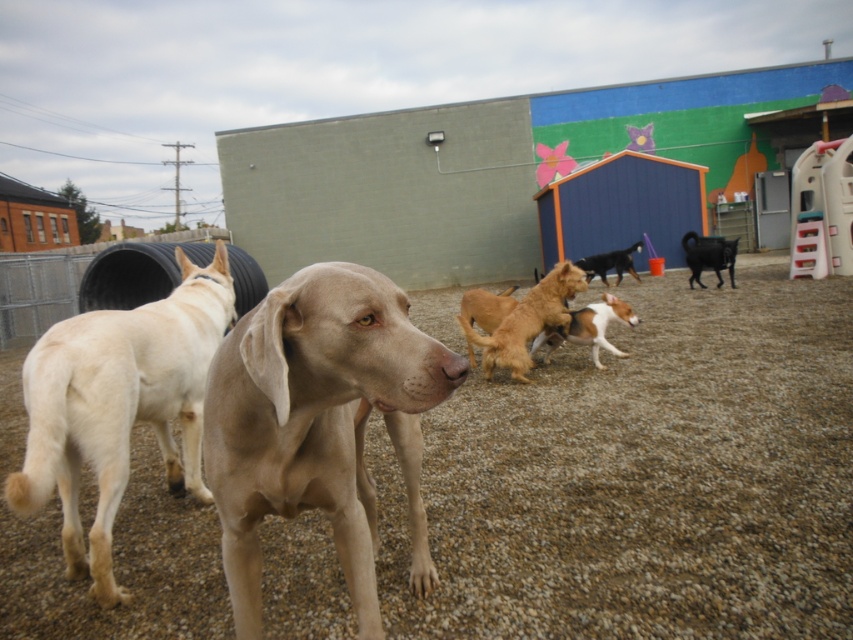
Question: Does brown gravel at center appear on the right side of white fur dog at center?

Choices:
 (A) no
 (B) yes

Answer: (B)

Question: Is smooth tan dog at center above black glossy dog at center?

Choices:
 (A) yes
 (B) no

Answer: (B)

Question: Which of the following is the farthest from the observer?

Choices:
 (A) golden fur dog at center
 (B) smooth tan dog at center
 (C) brown gravel at center

Answer: (A)

Question: Considering the relative positions of smooth tan dog at center and black glossy goat at center right in the image provided, where is smooth tan dog at center located with respect to black glossy goat at center right?

Choices:
 (A) left
 (B) right

Answer: (A)

Question: Which object is farther from the camera taking this photo?

Choices:
 (A) golden fur dog at center
 (B) light beige fur at left

Answer: (A)

Question: Considering the real-world distances, which object is closest to the black glossy dog at center?

Choices:
 (A) golden fur dog at center
 (B) smooth tan dog at center
 (C) white fur dog at center

Answer: (C)